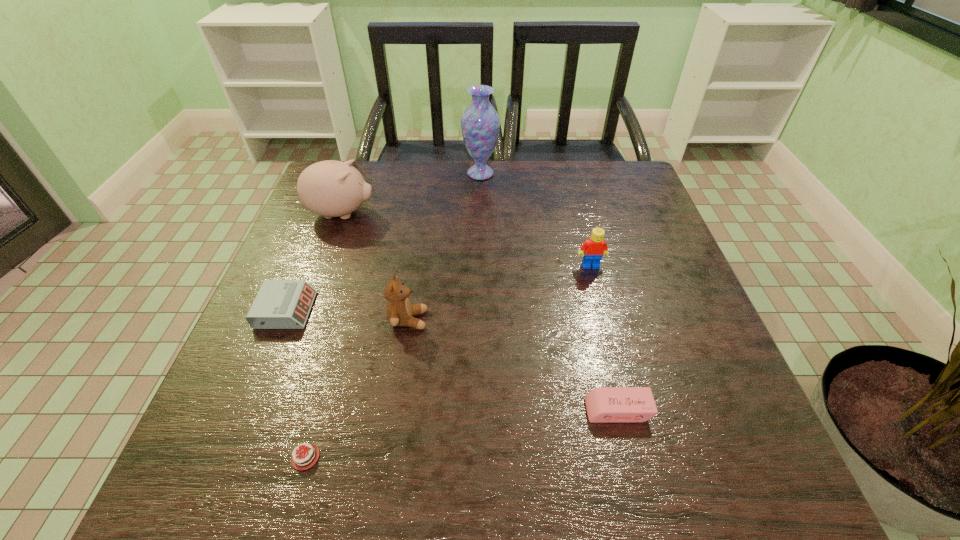
Find the location of a particular element. object identified as the second closest to the farthest object is located at coordinates (592, 250).

This screenshot has height=540, width=960. In order to click on object that is the fourth closest to the eraser in this screenshot , I will do `click(280, 304)`.

Where is `vacant space that satisfies the following two spatial constraints: 1. on the back side of the eraser; 2. on the front-facing side of the teddy bear`? vacant space that satisfies the following two spatial constraints: 1. on the back side of the eraser; 2. on the front-facing side of the teddy bear is located at coordinates (596, 320).

Where is `free space that satisfies the following two spatial constraints: 1. on the face of the Lego; 2. on the front-facing side of the fourth object from left to right`? free space that satisfies the following two spatial constraints: 1. on the face of the Lego; 2. on the front-facing side of the fourth object from left to right is located at coordinates (605, 320).

Find the location of a particular element. Image resolution: width=960 pixels, height=540 pixels. free region that satisfies the following two spatial constraints: 1. at the snout of the eraser; 2. on the right side of the sixth shortest object is located at coordinates (270, 410).

At what (x,y) coordinates should I click in order to perform the action: click on vacant space that satisfies the following two spatial constraints: 1. on the front side of the sixth farthest object; 2. on the left side of the alarm clock. Please return your answer as a coordinate pair (x, y). Looking at the image, I should click on (245, 410).

You are a GUI agent. You are given a task and a screenshot of the screen. Output one action in this format:
    pyautogui.click(x=<x>, y=<y>)
    Task: Click on the vacant region that satisfies the following two spatial constraints: 1. on the front side of the third object from right to left; 2. on the front-facing side of the fourth object from right to left
    
    Given the screenshot: What is the action you would take?
    pyautogui.click(x=481, y=320)